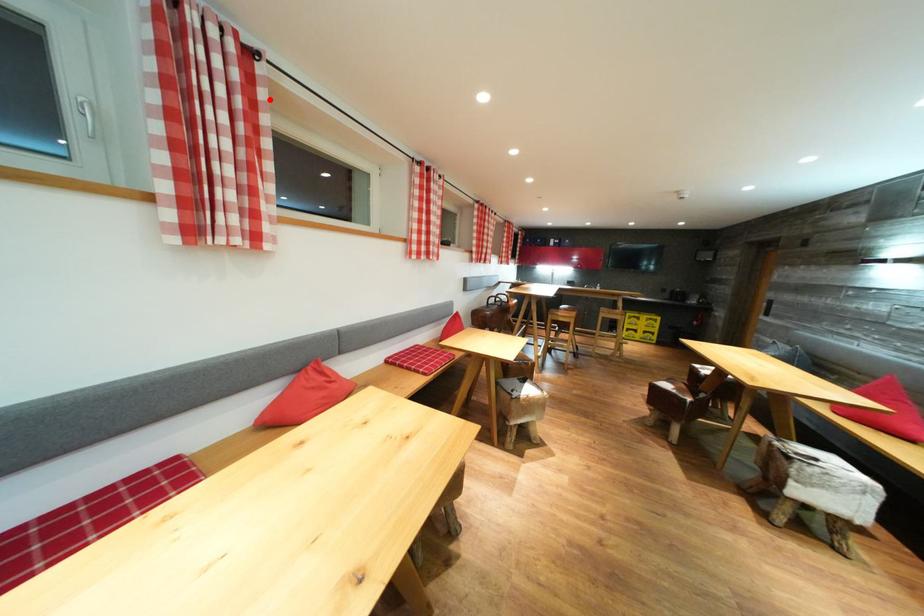
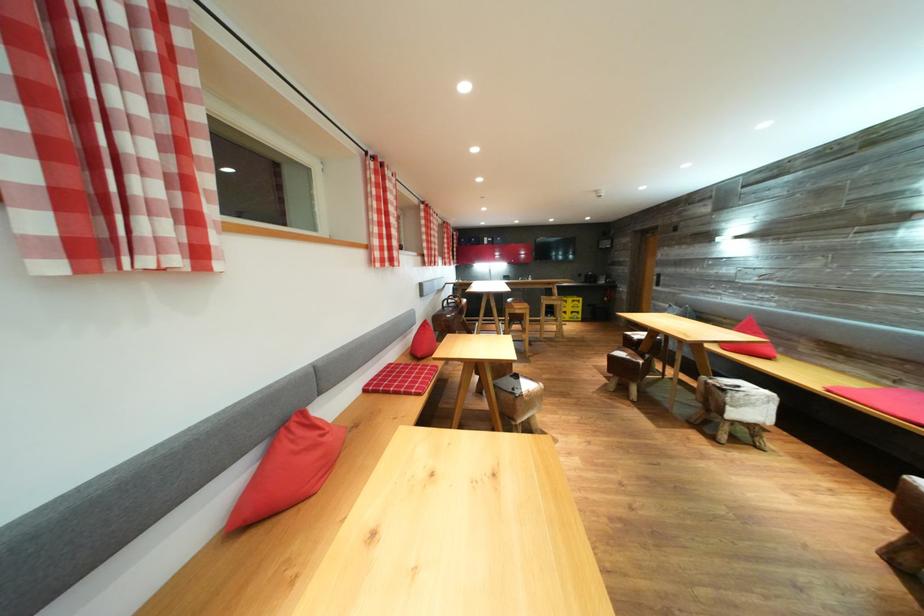
Locate, in the second image, the point that corresponds to the highlighted location in the first image.

(188, 43)